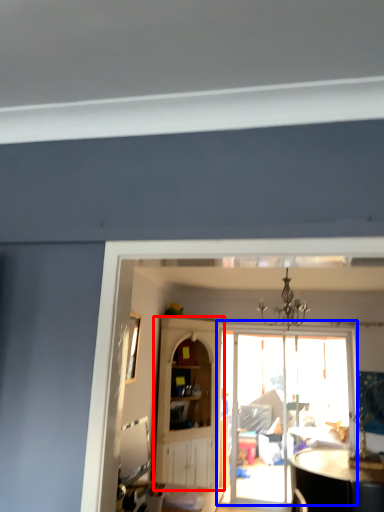
Question: Which object is closer to the camera taking this photo, cabinetry (highlighted by a red box) or door (highlighted by a blue box)?

Choices:
 (A) cabinetry
 (B) door

Answer: (A)